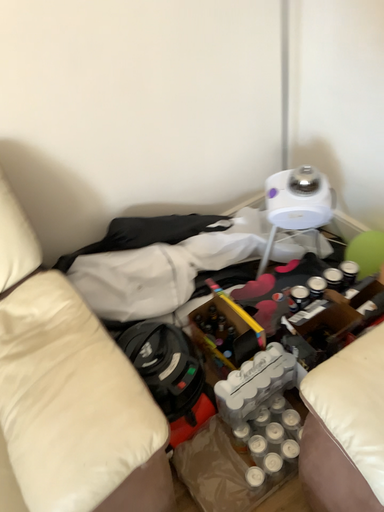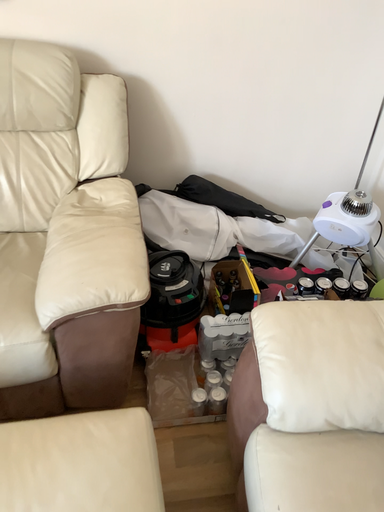
Question: Which way did the camera rotate in the video?

Choices:
 (A) rotated downward
 (B) rotated upward

Answer: (B)